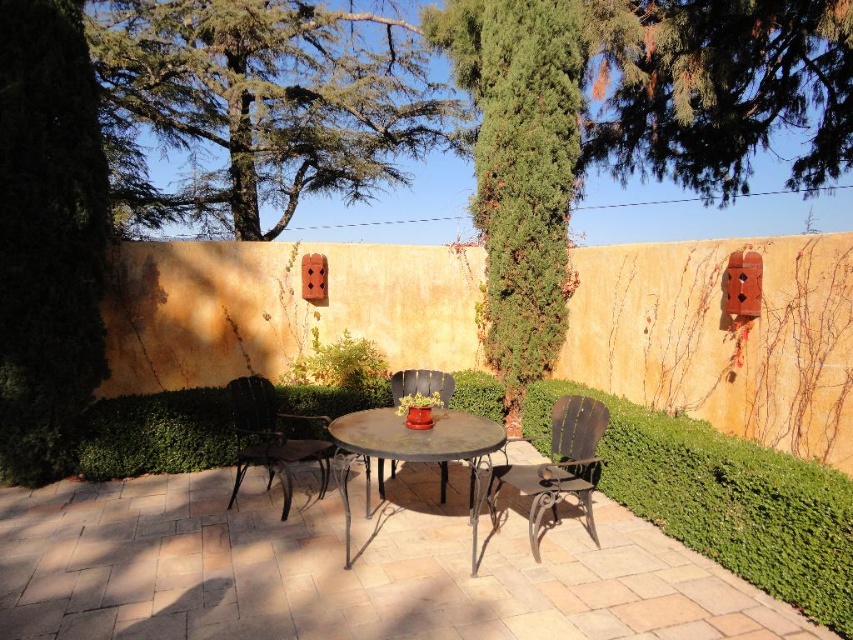
Is green leafy tree at left bigger than metallic dark brown chair at left?

Correct, green leafy tree at left is larger in size than metallic dark brown chair at left.

Find the location of `green leafy tree at left`. green leafy tree at left is located at coordinates (48, 236).

Can you confirm if green leafy tree at upper center is wider than dark brown wrought iron chair at center?

Correct, the width of green leafy tree at upper center exceeds that of dark brown wrought iron chair at center.

Which is below, green leafy tree at upper center or dark brown wrought iron chair at center?

dark brown wrought iron chair at center

Locate an element on the screen. This screenshot has height=640, width=853. green leafy tree at upper center is located at coordinates (723, 90).

Between green textured tree at center and rusty metal table at center, which one is positioned lower?

Positioned lower is rusty metal table at center.

Does green textured tree at center appear on the right side of rusty metal table at center?

Yes, green textured tree at center is to the right of rusty metal table at center.

Who is more forward, (457, 60) or (467, 426)?

Point (467, 426) is in front.

The width and height of the screenshot is (853, 640). What are the coordinates of `green textured tree at center` in the screenshot? It's located at coord(519,168).